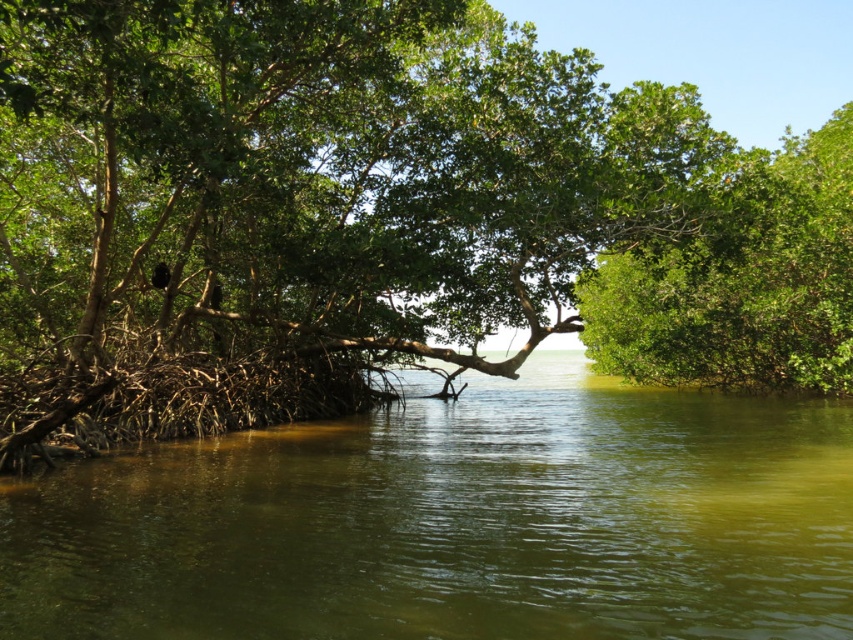
You are a small boat operator navigating through the mangrove forest. You see the green murky water at center and the green leafy tree at right. Which path would allow your boat to pass through more easily?

The green murky water at center has a larger width than the green leafy tree at right, so the path through the green murky water at center would allow the boat to pass through more easily.